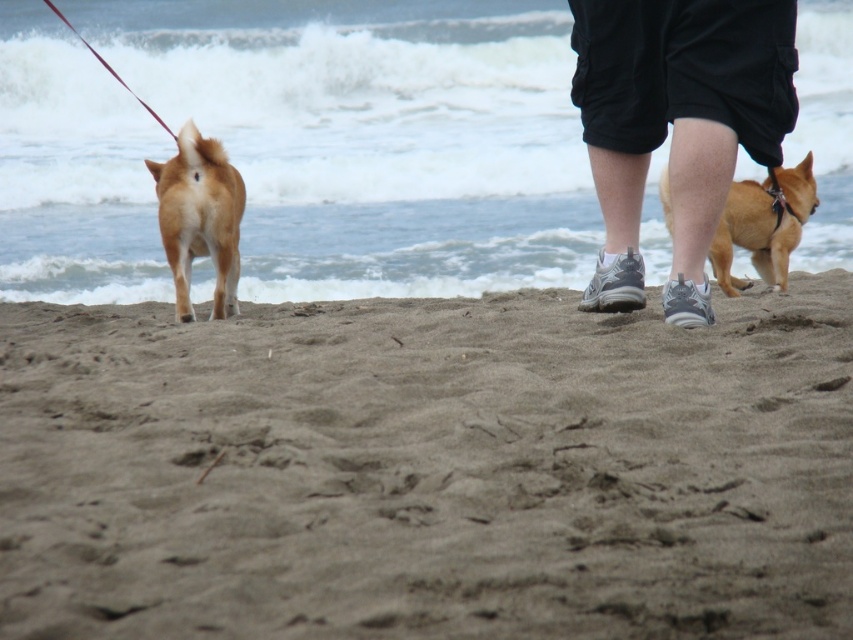
Question: Which of the following is the farthest from the observer?

Choices:
 (A) golden fur dog at center
 (B) golden fur dog at right
 (C) black cotton shorts at center
 (D) brown sandy beach at lower center

Answer: (B)

Question: Which point is closer to the camera?

Choices:
 (A) black cotton shorts at center
 (B) brown sandy beach at lower center

Answer: (B)

Question: Is black cotton shorts at center below golden fur dog at right?

Choices:
 (A) yes
 (B) no

Answer: (B)

Question: Can you confirm if black cotton shorts at center is positioned above golden fur dog at right?

Choices:
 (A) yes
 (B) no

Answer: (A)

Question: From the image, what is the correct spatial relationship of brown sandy beach at lower center in relation to golden fur dog at right?

Choices:
 (A) below
 (B) above

Answer: (A)

Question: Which point is closer to the camera?

Choices:
 (A) (607, 141)
 (B) (700, 548)

Answer: (B)